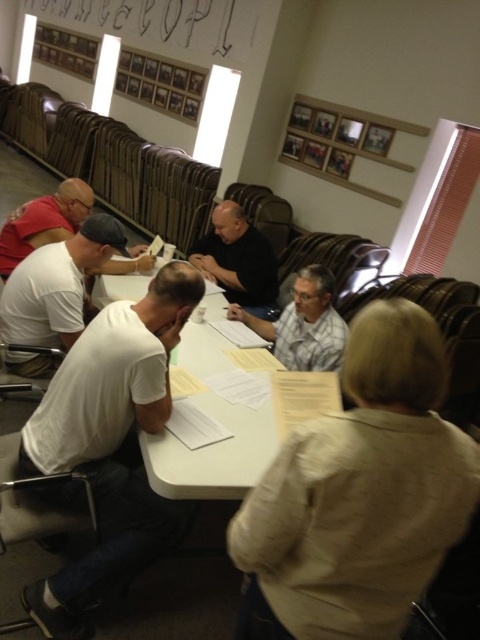
Question: Which of the following is the closest to the observer?

Choices:
 (A) gray fabric shirt at center
 (B) white matte shirt at left
 (C) black matte shirt at center
 (D) white cotton shirt at center

Answer: (D)

Question: Estimate the real-world distances between objects in this image. Which object is closer to the black matte shirt at center?

Choices:
 (A) gray fabric shirt at center
 (B) white matte shirt at left
 (C) white paper at center

Answer: (A)

Question: Can you confirm if white cotton shirt at center is positioned to the left of white matte shirt at left?

Choices:
 (A) no
 (B) yes

Answer: (A)

Question: Is white paper at center thinner than gray fabric shirt at center?

Choices:
 (A) no
 (B) yes

Answer: (A)

Question: Which point is closer to the camera taking this photo?

Choices:
 (A) pos(92,266)
 (B) pos(231,202)
 (C) pos(139,257)

Answer: (A)

Question: Can you confirm if white paper at center is bigger than black matte shirt at center?

Choices:
 (A) yes
 (B) no

Answer: (A)